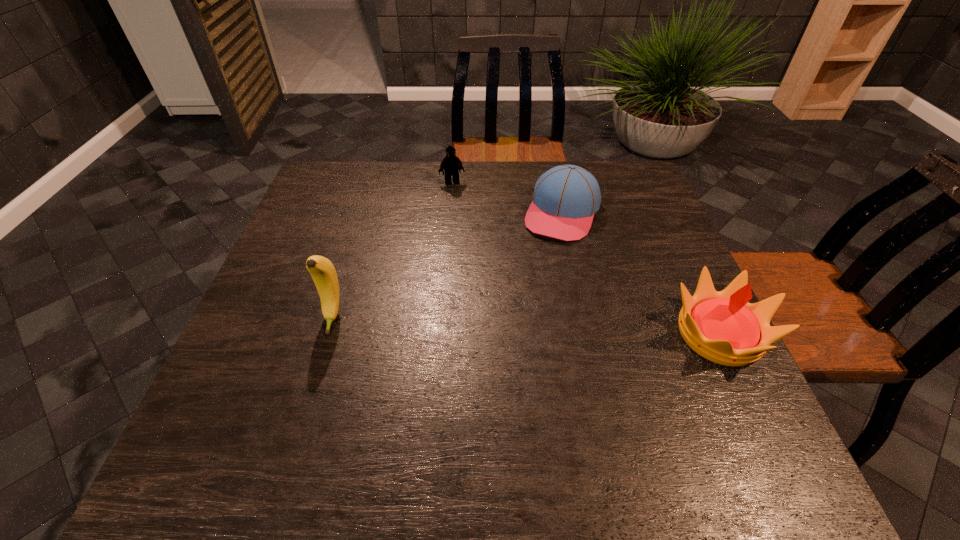
The height and width of the screenshot is (540, 960). I want to click on free location that satisfies the following two spatial constraints: 1. from the stem of the banana; 2. on the left side of the crown, so click(x=327, y=334).

In order to click on vacant region that satisfies the following two spatial constraints: 1. from the stem of the banana; 2. on the left side of the crown in this screenshot , I will do `click(327, 334)`.

I want to click on free space that satisfies the following two spatial constraints: 1. from the stem of the rightmost object; 2. on the right side of the banana, so (x=327, y=334).